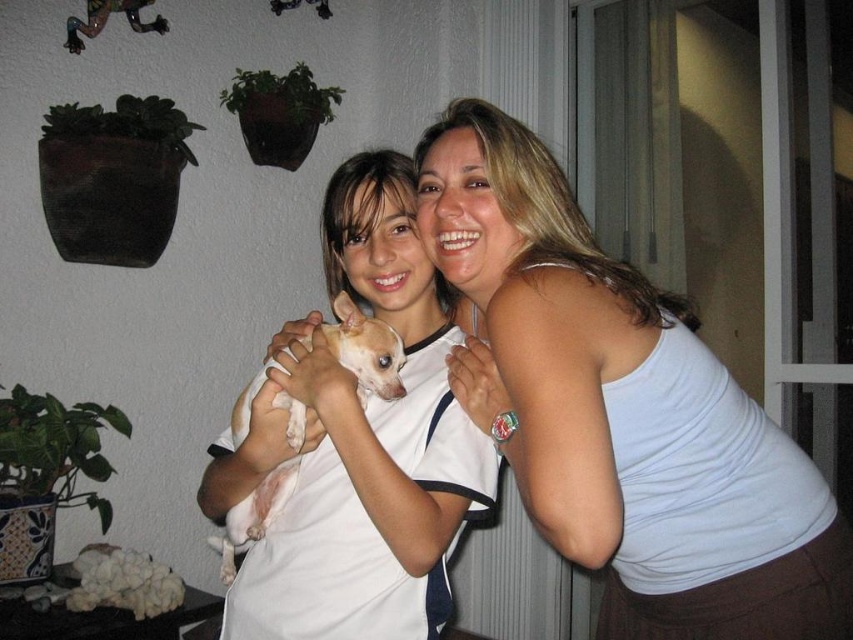
Based on the photo, what is the object located at the point with coordinates [361,448] in the image?

The object located at the point with coordinates [361,448] is the white soft fabric shirt at center.

You are a photographer setting up a shoot in this scene. You need to place a backdrop that must fit behind the white tank top at upper right and the white soft fabric shirt at center. Which object requires a wider backdrop?

The white tank top at upper right requires a wider backdrop because it might be wider than the white soft fabric shirt at center according to the description.

You are a photographer trying to capture a candid shot of the scene. You want to ensure the white tank top at upper right and the white soft fur dog at center are both in focus. Given their positions, which object should you focus on first to ensure both are sharp?

The white tank top at upper right is located above the white soft fur dog at center. To ensure both are in focus, you should focus on the white soft fur dog at center first since it is closer to the camera, allowing the white tank top at upper right to fall within the depth of field range.